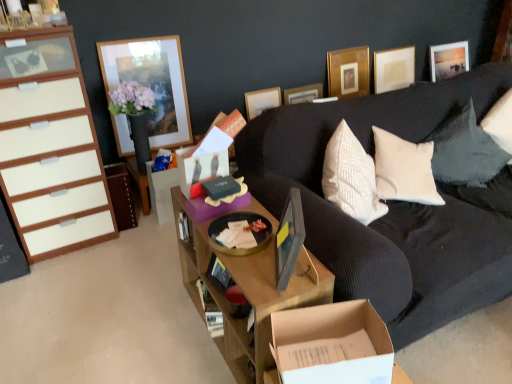
Locate an element on the screen. This screenshot has width=512, height=384. vacant space to the left of matte gray picture frame at center, the 1th picture frame in the front-to-back sequence is located at coordinates (257, 276).